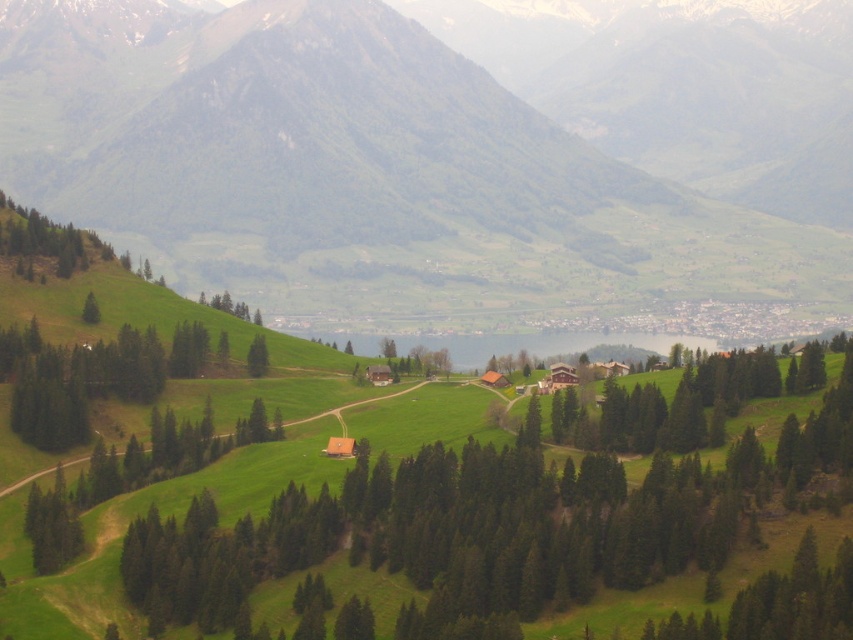
You are planning to set up a tent for a camping trip. You have two options for the location based on the image provided. The first option is on the green grassy hillside at center, and the second is near the green matte tree at upper left. Which location offers a wider area for setting up the tent?

The green grassy hillside at center is wider than the green matte tree at upper left, so the green grassy hillside at center offers a wider area for setting up the tent.

You are standing at the base of the mountain and looking towards the village. Which object, the green grassy hillside at center or the green matte tree at upper left, is positioned higher in your field of view?

The green grassy hillside at center is positioned higher in your field of view than the green matte tree at upper left because it is described as being above it.